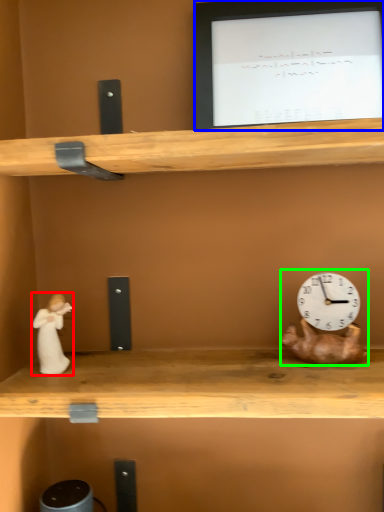
Question: Which object is the closest to the couple (highlighted by a red box)? Choose among these: computer monitor (highlighted by a blue box) or toy (highlighted by a green box).

Choices:
 (A) computer monitor
 (B) toy

Answer: (B)